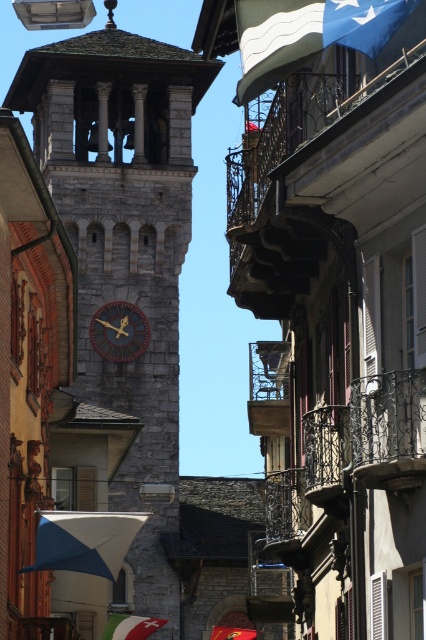
Question: Is blue fabric umbrella at center closer to camera compared to blue fabric flag at upper center?

Choices:
 (A) yes
 (B) no

Answer: (A)

Question: Is green fabric flag at center below blue fabric flag at upper center?

Choices:
 (A) yes
 (B) no

Answer: (B)

Question: Can you confirm if blue fabric flag at upper right is wider than blue fabric umbrella at center?

Choices:
 (A) no
 (B) yes

Answer: (B)

Question: Which of the following is the farthest from the observer?

Choices:
 (A) green fabric flag at center
 (B) blue fabric flag at upper center
 (C) stone clock tower at center

Answer: (B)

Question: Which object is farther from the camera taking this photo?

Choices:
 (A) green fabric flag at center
 (B) stone clock tower at center
 (C) blue fabric umbrella at center
 (D) wooden clock at center

Answer: (D)

Question: Which point appears farthest from the camera in this image?

Choices:
 (A) (164, 621)
 (B) (134, 342)

Answer: (B)